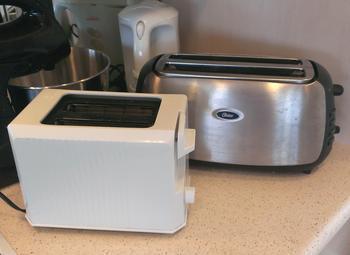
The height and width of the screenshot is (255, 350). Identify the location of heater. (104, 15).